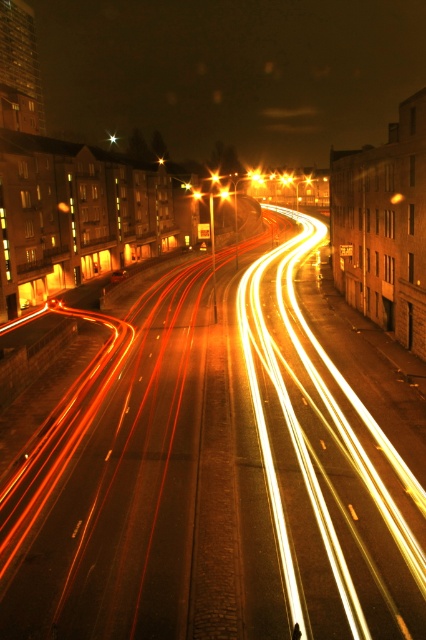
Question: Which object is closer to the camera taking this photo?

Choices:
 (A) metallic orange light at center
 (B) orange light at center

Answer: (B)

Question: Is amber glass traffic light at center to the left of orange light at center from the viewer's perspective?

Choices:
 (A) yes
 (B) no

Answer: (B)

Question: Is amber glass traffic light at center thinner than metallic orange light at center?

Choices:
 (A) yes
 (B) no

Answer: (B)

Question: Which point is farther from the camera taking this photo?

Choices:
 (A) (195, 192)
 (B) (229, 189)

Answer: (B)

Question: Does amber glass traffic light at center have a greater width compared to orange light at center?

Choices:
 (A) no
 (B) yes

Answer: (B)

Question: Among these points, which one is farthest from the camera?

Choices:
 (A) (193, 189)
 (B) (256, 176)
 (C) (230, 195)

Answer: (B)